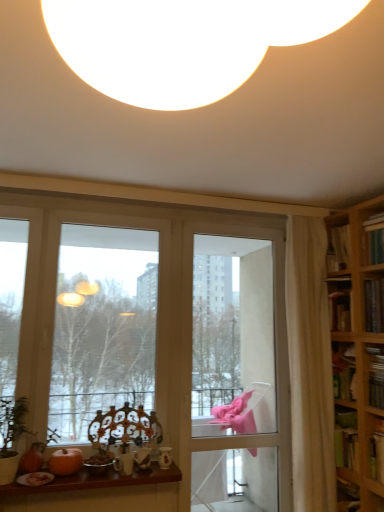
Locate an element on the screen. The height and width of the screenshot is (512, 384). blank space situated above transparent glass window at center (from a real-world perspective) is located at coordinates (96, 206).